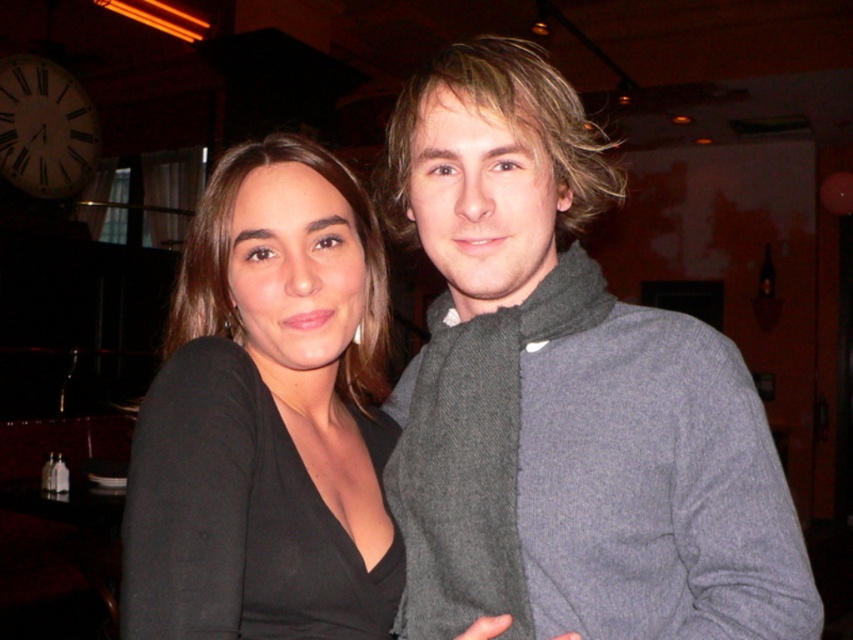
You are a photographer setting up for a group photo. You notice the black matte shirt at center and the white wooden clock at upper left in the frame. Which object is wider in the image?

The black matte shirt at center is wider than the white wooden clock at upper left according to the description.

You are standing in a dimly lit room with two people. You need to place a small table between the two points, point (171,419) and point (13,90). Which point should the table be closer to so it doesn not block the path between them?

The table should be closer to point (13,90) because point (171,419) is in front of point (13,90), so placing it closer to the latter would keep the path between them clear.

You are at a party and want to take a photo of the white wooden clock at upper left and the black matte shirt at center. Which object should you focus on first if you want to capture both in one shot without moving the camera?

The white wooden clock at upper left should be focused on first because the black matte shirt at center is to the right of it, so adjusting focus to the left ensures both are in frame.